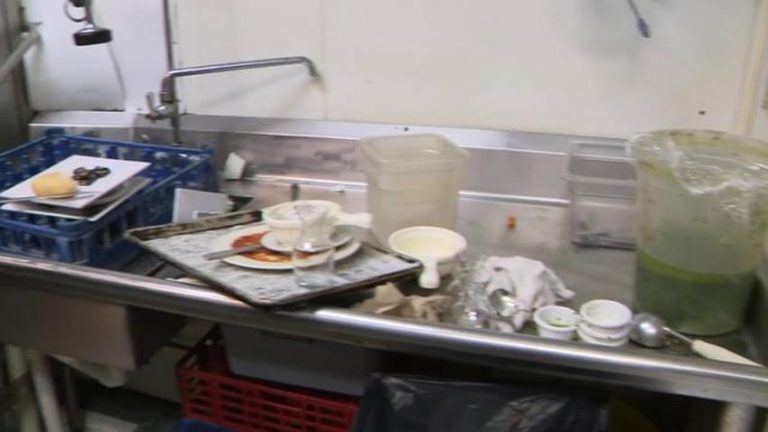
You are a GUI agent. You are given a task and a screenshot of the screen. Output one action in this format:
    pyautogui.click(x=<x>, y=<y>)
    Task: Click on the backsplash
    The width and height of the screenshot is (768, 432).
    Given the screenshot: What is the action you would take?
    pyautogui.click(x=505, y=162)